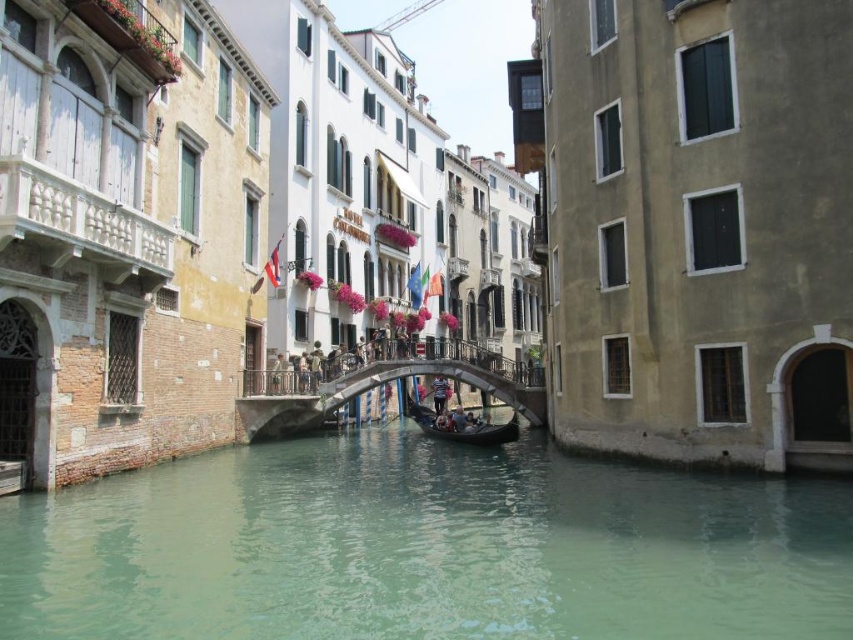
Question: Which of the following is the farthest from the observer?

Choices:
 (A) light pink fabric at center
 (B) green water at center
 (C) wooden gondola at center

Answer: (A)

Question: Which object is closer to the camera taking this photo?

Choices:
 (A) stone bridge at center
 (B) wooden gondola at center
 (C) light pink fabric at center

Answer: (A)

Question: Observing the image, what is the correct spatial positioning of green water at center in reference to light pink fabric at center?

Choices:
 (A) right
 (B) left

Answer: (B)

Question: Does green water at center have a larger size compared to light pink fabric at center?

Choices:
 (A) no
 (B) yes

Answer: (B)

Question: Estimate the real-world distances between objects in this image. Which object is farther from the light pink fabric at center?

Choices:
 (A) green water at center
 (B) stone bridge at center
 (C) wooden gondola at center

Answer: (A)

Question: Does green water at center come behind light pink fabric at center?

Choices:
 (A) yes
 (B) no

Answer: (B)